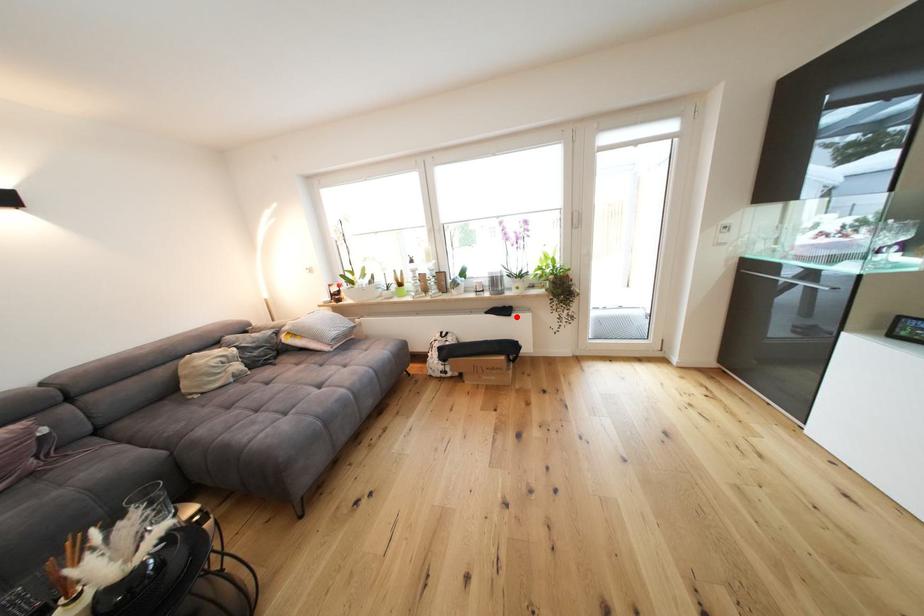
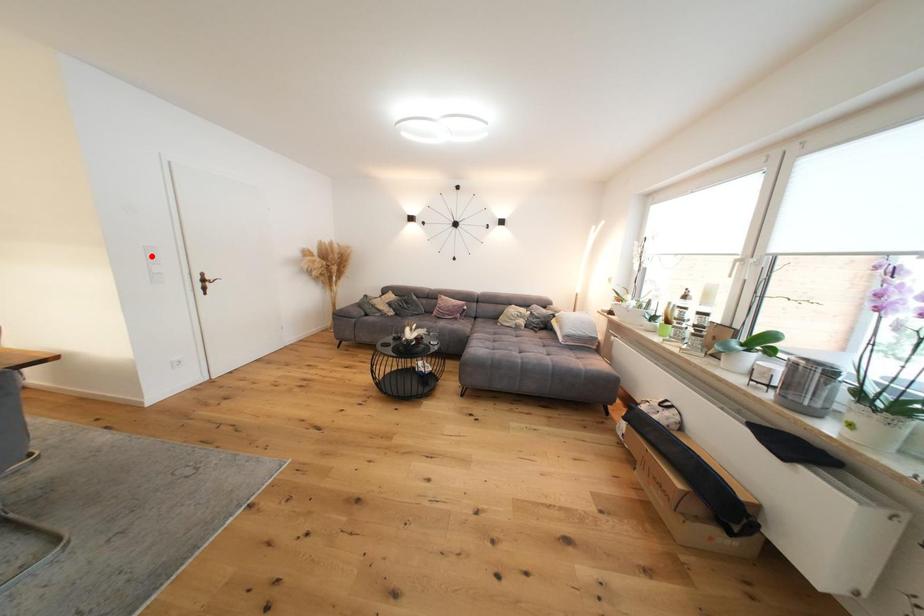
I am providing you with two images of the same scene from different viewpoints. A red point is marked on the first image and another point is marked on the second image. Does the point marked in image1 correspond to the same location as the one in image2?

No